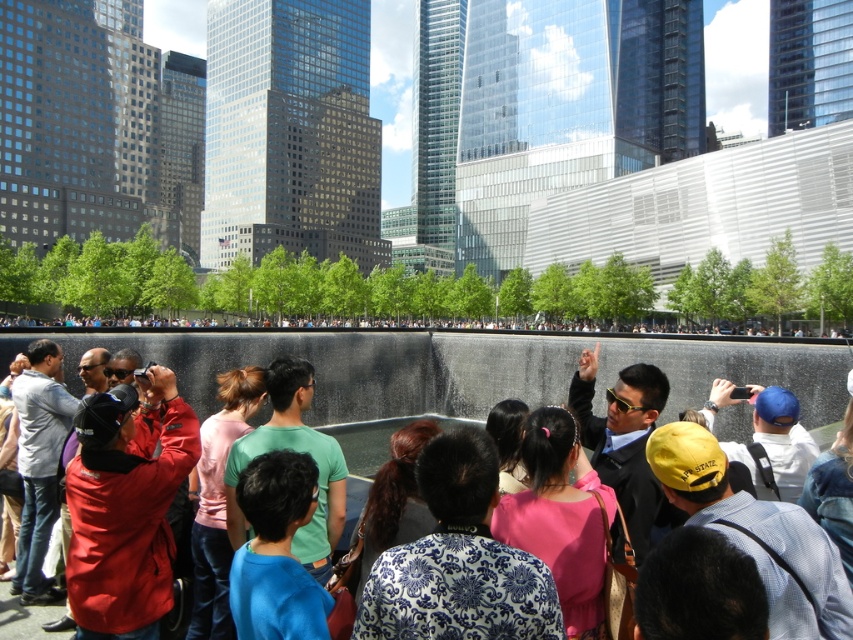
Is red matte jacket at lower left shorter than dark blue fabric at lower center?

No.

From the picture: Is red matte jacket at lower left bigger than dark blue fabric at lower center?

Yes.

Which is behind, point (103, 472) or point (720, 570)?

Point (103, 472)

Locate an element on the screen. red matte jacket at lower left is located at coordinates (126, 508).

Does point (393, 620) lie in front of point (502, 413)?

Yes, point (393, 620) is closer to viewer.

Is blue and white patterned shirt at center taller than black hair at center?

Yes.

Based on the photo, who is more distant from viewer, [431,627] or [500,484]?

The point [500,484] is more distant.

Image resolution: width=853 pixels, height=640 pixels. What are the coordinates of `blue and white patterned shirt at center` in the screenshot? It's located at (457, 561).

Describe the element at coordinates (561, 516) in the screenshot. I see `pink fabric dress at center` at that location.

Is pink fabric dress at center smaller than black hair at center?

Yes.

Where is `pink fabric dress at center`? This screenshot has height=640, width=853. pink fabric dress at center is located at coordinates (561, 516).